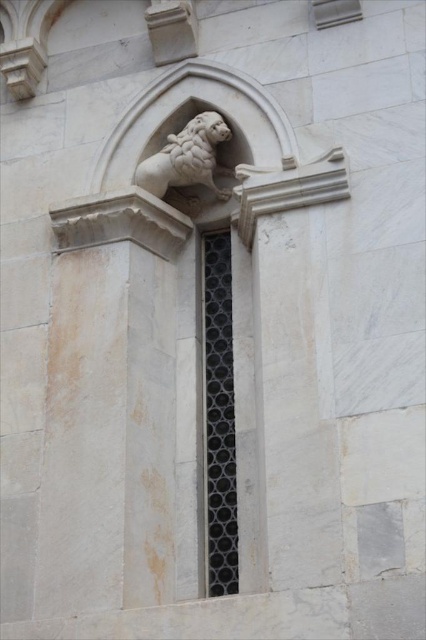
Is the position of black mesh window at center more distant than that of white marble lion at upper center?

That is False.

Which is above, black mesh window at center or white marble lion at upper center?

white marble lion at upper center is higher up.

This screenshot has height=640, width=426. Identify the location of black mesh window at center. (218, 417).